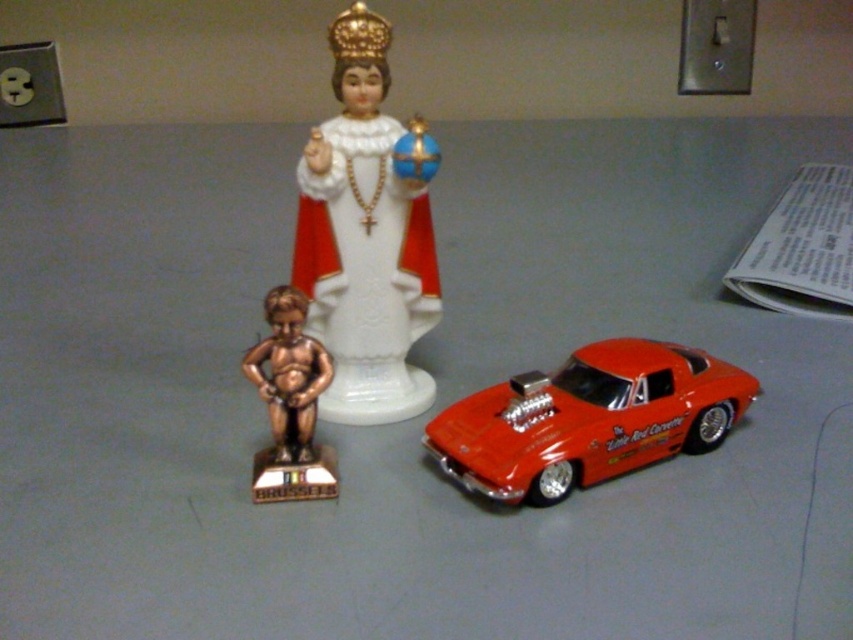
Is point (415, 340) positioned in front of point (537, 380)?

No, it is not.

Locate an element on the screen. The image size is (853, 640). white porcelain statue at center is located at coordinates (364, 240).

Is shiny red car at center to the right of gold-bronze statue at left from the viewer's perspective?

Correct, you'll find shiny red car at center to the right of gold-bronze statue at left.

Measure the distance between shiny red car at center and gold-bronze statue at left.

The distance of shiny red car at center from gold-bronze statue at left is 10.25 inches.

Which is in front, point (682, 416) or point (260, 385)?

Point (260, 385)

You are a GUI agent. You are given a task and a screenshot of the screen. Output one action in this format:
    pyautogui.click(x=<x>, y=<y>)
    Task: Click on the shiny red car at center
    Image resolution: width=853 pixels, height=640 pixels.
    Given the screenshot: What is the action you would take?
    pyautogui.click(x=589, y=419)

Who is higher up, white porcelain statue at center or gold-bronze statue at left?

white porcelain statue at center is higher up.

Can you confirm if white porcelain statue at center is bigger than gold-bronze statue at left?

Correct, white porcelain statue at center is larger in size than gold-bronze statue at left.

Between point (352, 323) and point (258, 492), which one is positioned in front?

Point (258, 492)

You are a GUI agent. You are given a task and a screenshot of the screen. Output one action in this format:
    pyautogui.click(x=<x>, y=<y>)
    Task: Click on the white porcelain statue at center
    This screenshot has height=640, width=853.
    Given the screenshot: What is the action you would take?
    pyautogui.click(x=364, y=240)